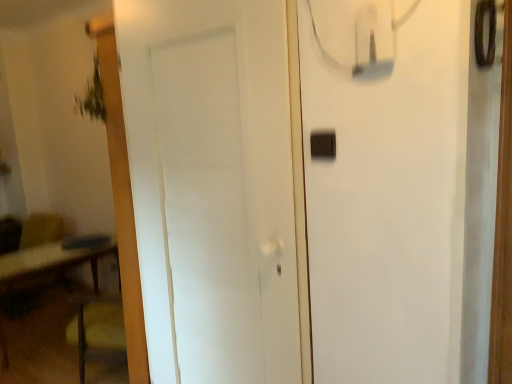
Question: From a real-world perspective, relative to black plastic light switch at upper right, is white matte door at center vertically above or below?

Choices:
 (A) below
 (B) above

Answer: (A)

Question: Considering the positions of white matte door at center and black plastic light switch at upper right in the image, is white matte door at center wider or thinner than black plastic light switch at upper right?

Choices:
 (A) thin
 (B) wide

Answer: (B)

Question: From the image's perspective, relative to black plastic light switch at upper right, is white matte door at center above or below?

Choices:
 (A) above
 (B) below

Answer: (B)

Question: Is point (309, 137) closer or farther from the camera than point (173, 64)?

Choices:
 (A) farther
 (B) closer

Answer: (B)

Question: From the image's perspective, is black plastic light switch at upper right positioned above or below white matte door at center?

Choices:
 (A) above
 (B) below

Answer: (A)

Question: In terms of size, does black plastic light switch at upper right appear bigger or smaller than white matte door at center?

Choices:
 (A) big
 (B) small

Answer: (B)

Question: Is black plastic light switch at upper right inside or outside of white matte door at center?

Choices:
 (A) outside
 (B) inside

Answer: (A)